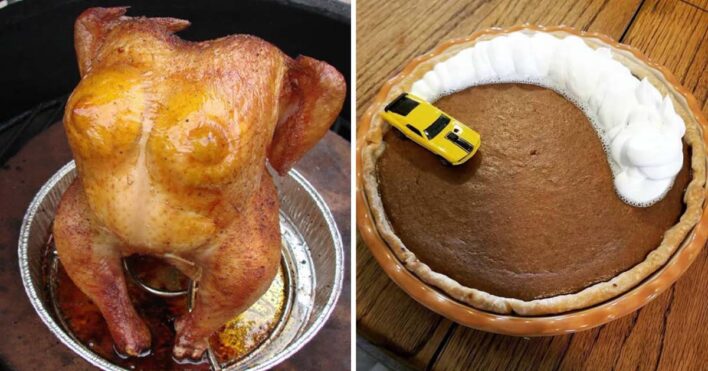
This screenshot has width=708, height=371. In order to click on yellow sports car toy in this screenshot , I will do `click(423, 115)`.